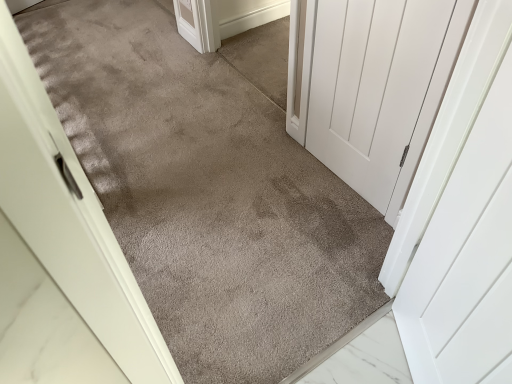
Where is `vacant region to the left of white matte door at center`? vacant region to the left of white matte door at center is located at coordinates coord(284,185).